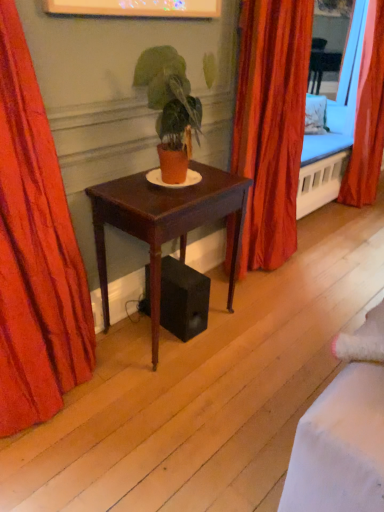
Where is `free space in front of silky orange curtain at center, which ranks as the second curtain in right-to-left order`? free space in front of silky orange curtain at center, which ranks as the second curtain in right-to-left order is located at coordinates (277, 301).